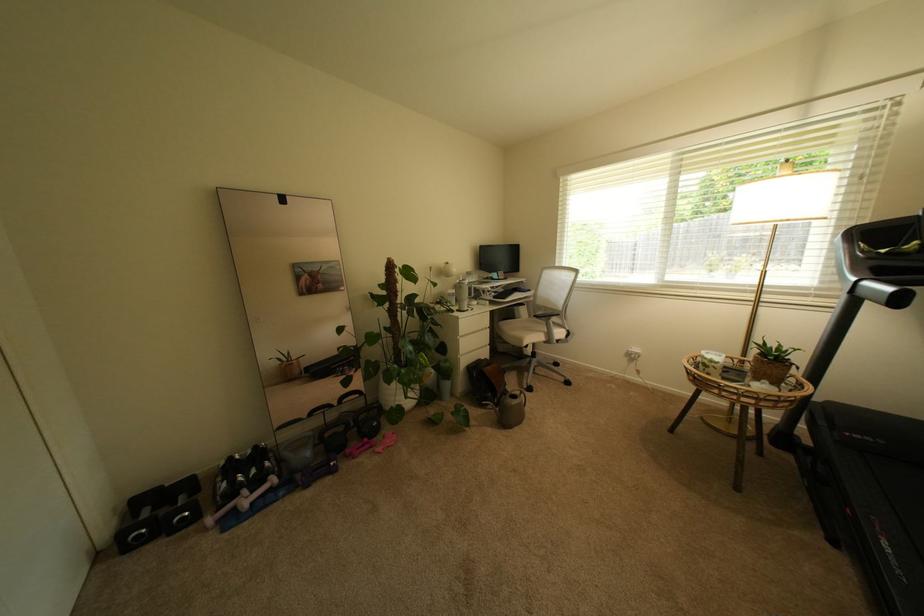
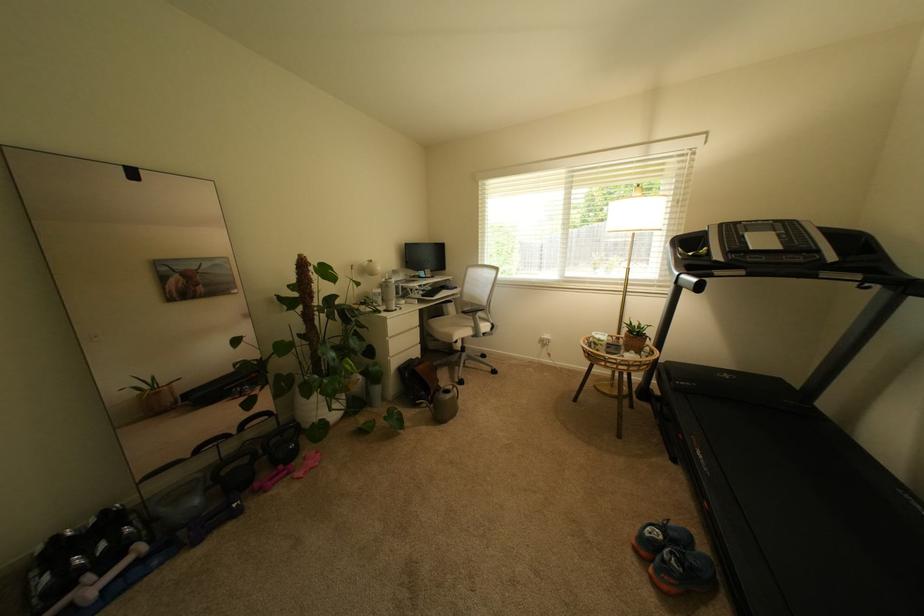
Question: The camera is either moving clockwise (left) or counter-clockwise (right) around the object. The first image is from the beginning of the video and the second image is from the end. Is the camera moving left or right when shooting the video?

Choices:
 (A) Left
 (B) Right

Answer: (A)